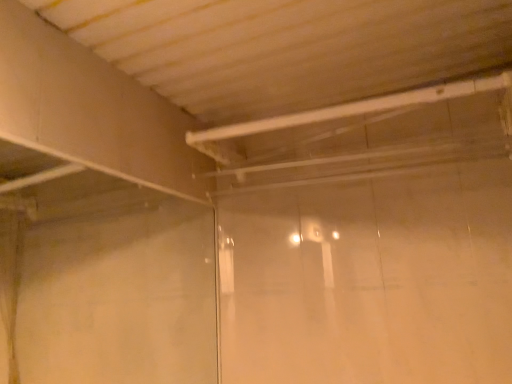
The height and width of the screenshot is (384, 512). In order to click on white glossy shower at upper center in this screenshot , I will do `click(355, 108)`.

Describe the element at coordinates (355, 108) in the screenshot. Image resolution: width=512 pixels, height=384 pixels. I see `white glossy shower at upper center` at that location.

The image size is (512, 384). Identify the location of white glossy shower at upper center. (355, 108).